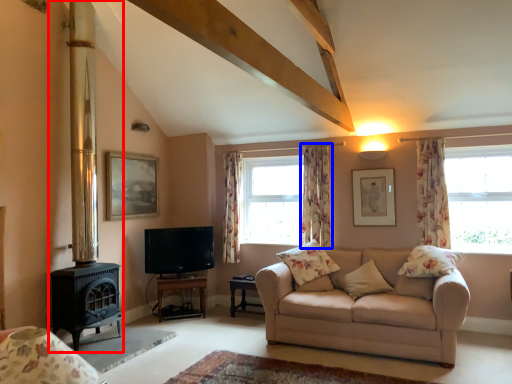
Question: Among these objects, which one is farthest to the camera, fireplace (highlighted by a red box) or curtain (highlighted by a blue box)?

Choices:
 (A) fireplace
 (B) curtain

Answer: (B)